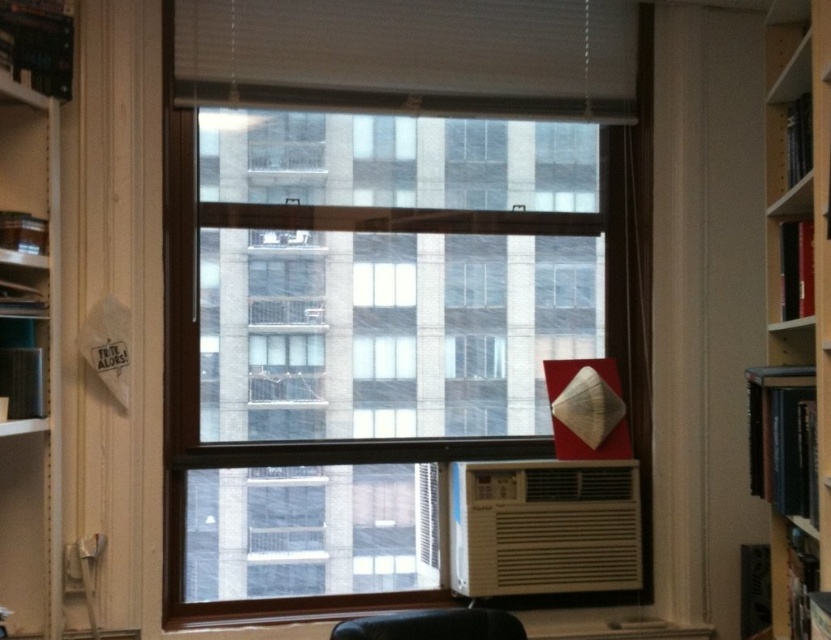
Question: Which point is farther from the camera taking this photo?

Choices:
 (A) (371, 627)
 (B) (22, 16)
 (C) (283, 93)
 (D) (603, 588)

Answer: (D)

Question: Considering the real-world distances, which object is farthest from the white plastic air conditioner at lower center?

Choices:
 (A) white matte blinds at upper center
 (B) white cardboard box at left

Answer: (B)

Question: Can you confirm if white matte blinds at upper center is bigger than white plastic air conditioner at lower center?

Choices:
 (A) yes
 (B) no

Answer: (A)

Question: Can you confirm if wooden bookshelf at right is positioned above black leather armchair at lower center?

Choices:
 (A) no
 (B) yes

Answer: (B)

Question: Observing the image, what is the correct spatial positioning of white cardboard box at left in reference to wooden bookshelf at right?

Choices:
 (A) above
 (B) below

Answer: (A)

Question: Which point is farther to the camera?

Choices:
 (A) (328, 99)
 (B) (406, 637)
 (C) (638, 561)

Answer: (C)